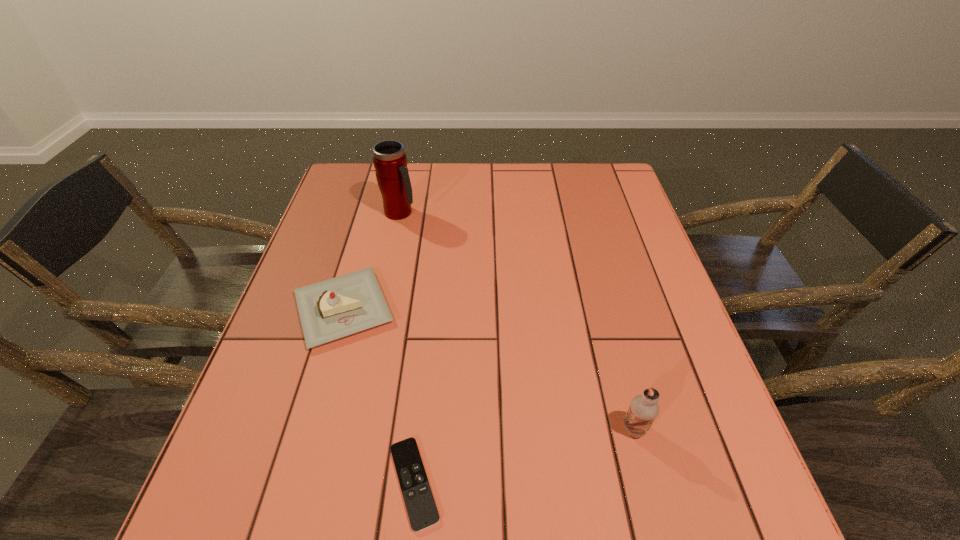
Locate an element on the screen. thermos bottle is located at coordinates (390, 162).

Locate an element on the screen. Image resolution: width=960 pixels, height=540 pixels. the farthest object is located at coordinates (390, 162).

Image resolution: width=960 pixels, height=540 pixels. Find the location of `the rightmost object`. the rightmost object is located at coordinates (643, 409).

I want to click on chocolate milk, so click(643, 409).

Image resolution: width=960 pixels, height=540 pixels. I want to click on the second shortest object, so click(338, 307).

Where is `cake`? The height and width of the screenshot is (540, 960). cake is located at coordinates (338, 307).

You are a GUI agent. You are given a task and a screenshot of the screen. Output one action in this format:
    pyautogui.click(x=<x>, y=<y>)
    Task: Click on the remote control
    This screenshot has width=960, height=540.
    Given the screenshot: What is the action you would take?
    pyautogui.click(x=422, y=511)

Image resolution: width=960 pixels, height=540 pixels. What are the coordinates of `the shortest object` in the screenshot? It's located at pos(422,511).

At what (x,y) coordinates should I click in order to perform the action: click on vacant space located on the side with the handle of the tallest object. Please return your answer as a coordinate pair (x, y). This screenshot has width=960, height=540. Looking at the image, I should click on (529, 213).

The height and width of the screenshot is (540, 960). What are the coordinates of `free space located 0.240m on the back of the chocolate milk` in the screenshot? It's located at (606, 320).